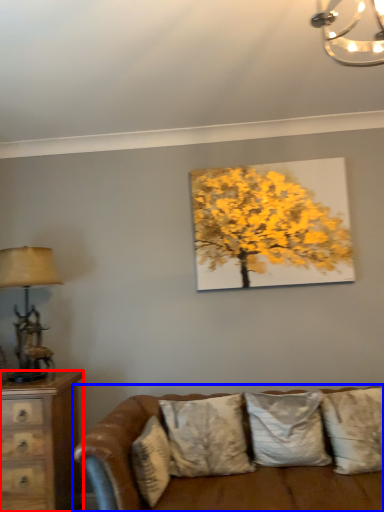
Question: Which of the following is the farthest to the observer, chest of drawers (highlighted by a red box) or studio couch (highlighted by a blue box)?

Choices:
 (A) chest of drawers
 (B) studio couch

Answer: (A)